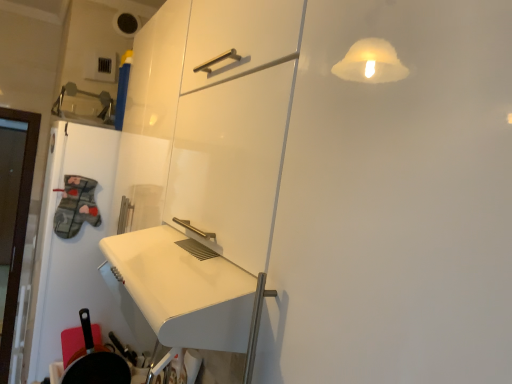
Locate an element on the screen. This screenshot has width=512, height=384. white glossy door at left is located at coordinates (70, 244).

What do you see at coordinates (70, 244) in the screenshot?
I see `white glossy door at left` at bounding box center [70, 244].

I want to click on black matte frying pan at lower left, so click(x=95, y=361).

In order to face black matte frying pan at lower left, should I rotate leftwards or rightwards?

A 20.260 degree turn to the left will do.

What do you see at coordinates (95, 361) in the screenshot? The image size is (512, 384). I see `black matte frying pan at lower left` at bounding box center [95, 361].

Identify the location of white glossy door at left. The width and height of the screenshot is (512, 384). (70, 244).

Which object is positioned more to the left, white glossy door at left or black matte frying pan at lower left?

From the viewer's perspective, white glossy door at left appears more on the left side.

Based on the photo, in the image, is white glossy door at left positioned in front of or behind black matte frying pan at lower left?

white glossy door at left is positioned farther from the viewer than black matte frying pan at lower left.

Which is in front, point (72, 252) or point (73, 357)?

Point (73, 357)

From the image's perspective, does white glossy door at left appear lower than black matte frying pan at lower left?

Actually, white glossy door at left appears above black matte frying pan at lower left in the image.

From a real-world perspective, is white glossy door at left physically below black matte frying pan at lower left?

Incorrect, from a real-world perspective, white glossy door at left is higher than black matte frying pan at lower left.

Which object is thinner, white glossy door at left or black matte frying pan at lower left?

Thinner between the two is black matte frying pan at lower left.

Does white glossy door at left have a greater height compared to black matte frying pan at lower left?

Indeed, white glossy door at left has a greater height compared to black matte frying pan at lower left.

In the scene shown: Looking at the image, does white glossy door at left seem bigger or smaller compared to black matte frying pan at lower left?

white glossy door at left is bigger than black matte frying pan at lower left.

Can we say white glossy door at left lies outside black matte frying pan at lower left?

Absolutely, white glossy door at left is external to black matte frying pan at lower left.

Is white glossy door at left far away from black matte frying pan at lower left?

They are positioned close to each other.

Is white glossy door at left turned away from black matte frying pan at lower left?

white glossy door at left does not have its back to black matte frying pan at lower left.

This screenshot has width=512, height=384. Find the location of `frying pan on the right of white glossy door at left`. frying pan on the right of white glossy door at left is located at coordinates (95, 361).

Between black matte frying pan at lower left and white glossy door at left, which one appears on the right side from the viewer's perspective?

black matte frying pan at lower left is more to the right.

Which object is further away from the camera, black matte frying pan at lower left or white glossy door at left?

Positioned behind is white glossy door at left.

Which point is more forward, (93, 381) or (106, 234)?

The point (93, 381) is more forward.

From the image's perspective, which is above, black matte frying pan at lower left or white glossy door at left?

white glossy door at left appears higher in the image.

From a real-world perspective, which object stands above the other?

In real-world perspective, white glossy door at left is above.

Which object is wider, black matte frying pan at lower left or white glossy door at left?

Wider between the two is white glossy door at left.

Considering the sizes of objects black matte frying pan at lower left and white glossy door at left in the image provided, who is shorter, black matte frying pan at lower left or white glossy door at left?

black matte frying pan at lower left.

Is black matte frying pan at lower left bigger than white glossy door at left?

Actually, black matte frying pan at lower left might be smaller than white glossy door at left.

Would you say black matte frying pan at lower left contains white glossy door at left?

Actually, white glossy door at left is outside black matte frying pan at lower left.

Would you say black matte frying pan at lower left is a long distance from white glossy door at left?

They are positioned close to each other.

Could you tell me if black matte frying pan at lower left is facing white glossy door at left?

No, black matte frying pan at lower left does not turn towards white glossy door at left.

This screenshot has width=512, height=384. Identify the location of frying pan that is below the white glossy door at left (from the image's perspective). coord(95,361).

Locate an element on the screen. Image resolution: width=512 pixels, height=384 pixels. frying pan that is under the white glossy door at left (from a real-world perspective) is located at coordinates (95, 361).

Find the location of a particular element. frying pan on the right of white glossy door at left is located at coordinates point(95,361).